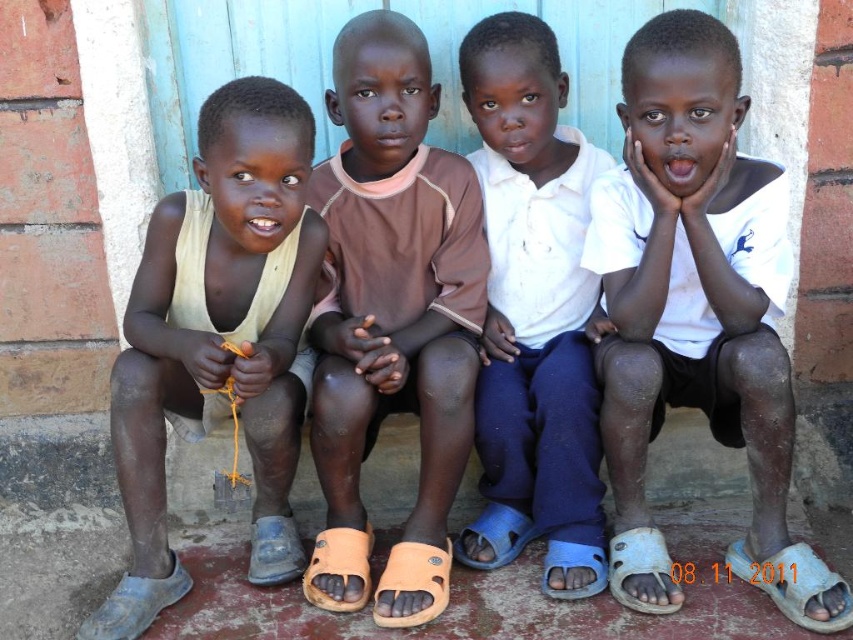
Is gray fabric sandal at lower left wider than white plastic sandal at lower right?

Yes.

Measure the distance from gray fabric sandal at lower left to white plastic sandal at lower right.

gray fabric sandal at lower left is 4.15 feet away from white plastic sandal at lower right.

Which is in front, point (178, 593) or point (654, 564)?

Point (654, 564)

You are a GUI agent. You are given a task and a screenshot of the screen. Output one action in this format:
    pyautogui.click(x=<x>, y=<y>)
    Task: Click on the gray fabric sandal at lower left
    The height and width of the screenshot is (640, 853).
    Given the screenshot: What is the action you would take?
    click(134, 604)

Does brown matte sandal at center lie in front of gray fabric sandal at lower left?

No.

Is brown matte sandal at center to the left of gray fabric sandal at lower left from the viewer's perspective?

No, brown matte sandal at center is not to the left of gray fabric sandal at lower left.

Locate an element on the screen. Image resolution: width=853 pixels, height=640 pixels. brown matte sandal at center is located at coordinates [392, 316].

Where is `brown matte sandal at center`? Image resolution: width=853 pixels, height=640 pixels. brown matte sandal at center is located at coordinates (392, 316).

Can you confirm if matte yellow tank top at left is positioned above white plastic sandal at lower right?

Correct, matte yellow tank top at left is located above white plastic sandal at lower right.

Which is below, matte yellow tank top at left or white plastic sandal at lower right?

white plastic sandal at lower right

Which is in front, point (281, 378) or point (622, 573)?

Point (281, 378)

I want to click on matte yellow tank top at left, so click(x=218, y=339).